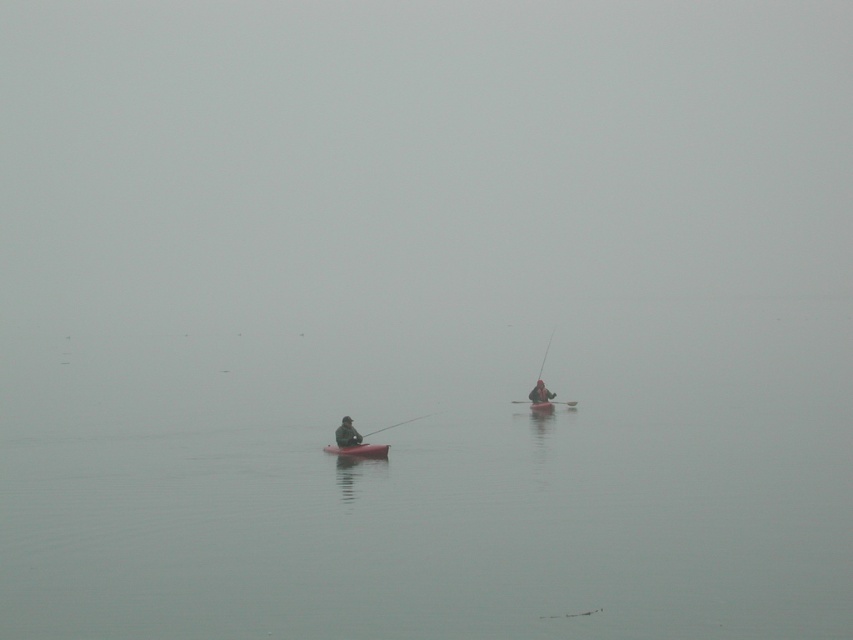
Between green fabric jacket at center and smooth red canoe at center, which one appears on the left side from the viewer's perspective?

green fabric jacket at center is more to the left.

Between point (350, 444) and point (541, 410), which one is positioned in front?

Point (350, 444) is in front.

You are a GUI agent. You are given a task and a screenshot of the screen. Output one action in this format:
    pyautogui.click(x=<x>, y=<y>)
    Task: Click on the green fabric jacket at center
    The image size is (853, 640).
    Given the screenshot: What is the action you would take?
    pyautogui.click(x=346, y=433)

Is smooth plastic paddle at center positioned behind smooth plastic rod at center?

Yes, it is.

Does smooth plastic paddle at center appear on the left side of smooth plastic rod at center?

Incorrect, smooth plastic paddle at center is not on the left side of smooth plastic rod at center.

Identify the location of smooth plastic paddle at center. (544, 403).

Is point (375, 444) in front of point (537, 406)?

Yes, it is in front of point (537, 406).

Which of these two, matte pink canoe at center or smooth red canoe at center, stands taller?

smooth red canoe at center

Which is behind, point (344, 449) or point (537, 410)?

Point (537, 410)

The height and width of the screenshot is (640, 853). In order to click on matte pink canoe at center in this screenshot , I will do `click(358, 451)`.